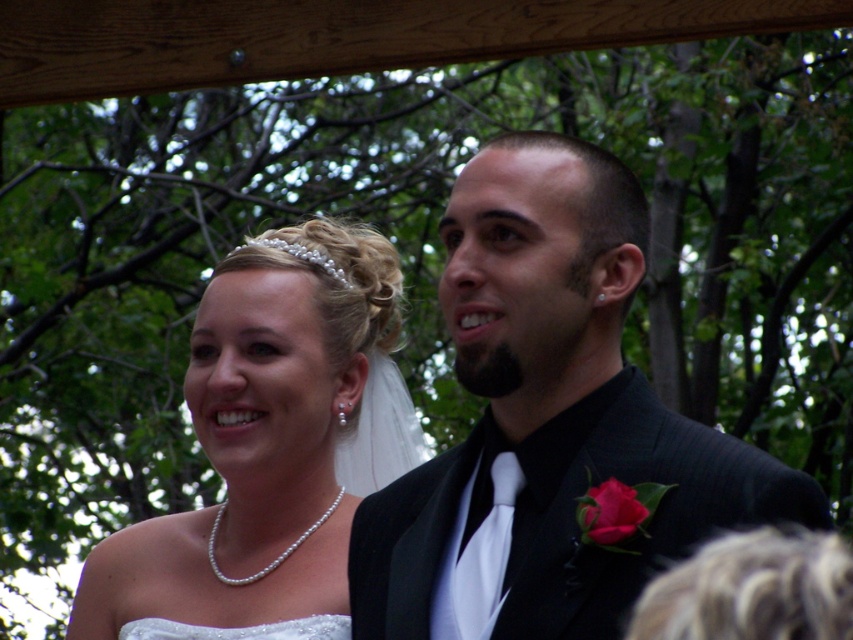
You are a photographer at this wedding and need to capture a closeup of the shiny black suit at center without the matte pink rose at lower right appearing in the background. Is this possible given their positions?

The matte pink rose at lower right is behind the shiny black suit at center, so positioning the camera to focus on the shiny black suit at center while ensuring the matte pink rose at lower right is out of frame would allow capturing the closeup without the rose in the background.